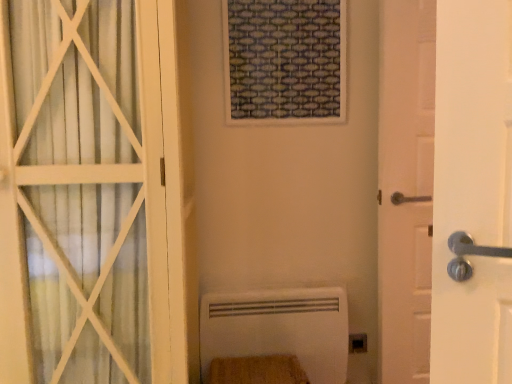
Question: From the image's perspective, would you say white matte door at left, which ranks as the 2th door in right-to-left order, is shown under white wooden door at right, which ranks as the 2th door in left-to-right order?

Choices:
 (A) yes
 (B) no

Answer: (A)

Question: Could you tell me if white matte door at left, which is the 1th door from left to right, is facing white wooden door at right, which ranks as the 2th door in left-to-right order?

Choices:
 (A) no
 (B) yes

Answer: (A)

Question: Is white matte door at left, which ranks as the 2th door in right-to-left order, oriented away from white wooden door at right, which ranks as the 2th door in left-to-right order?

Choices:
 (A) yes
 (B) no

Answer: (B)

Question: Is the position of white matte door at left, which is the 1th door from left to right, less distant than that of white wooden door at right, which ranks as the 2th door in left-to-right order?

Choices:
 (A) yes
 (B) no

Answer: (A)

Question: Is white matte door at left, which ranks as the 2th door in right-to-left order, outside white wooden door at right, which ranks as the 2th door in left-to-right order?

Choices:
 (A) no
 (B) yes

Answer: (B)

Question: From a real-world perspective, is white matte door at left, which is the 1th door from left to right, located higher than white wooden door at right, the 1th door viewed from the right?

Choices:
 (A) yes
 (B) no

Answer: (A)

Question: Could white wooden door at right, the 1th door viewed from the right, be considered to be inside white matte radiator at lower center?

Choices:
 (A) yes
 (B) no

Answer: (B)

Question: Does white matte radiator at lower center appear on the left side of white wooden door at right, the 1th door viewed from the right?

Choices:
 (A) yes
 (B) no

Answer: (A)

Question: From a real-world perspective, is white matte radiator at lower center below white wooden door at right, which ranks as the 2th door in left-to-right order?

Choices:
 (A) no
 (B) yes

Answer: (B)

Question: From the image's perspective, is white matte radiator at lower center beneath white wooden door at right, the 1th door viewed from the right?

Choices:
 (A) no
 (B) yes

Answer: (B)

Question: Could you tell me if white matte radiator at lower center is turned towards white wooden door at right, which ranks as the 2th door in left-to-right order?

Choices:
 (A) yes
 (B) no

Answer: (B)

Question: Is white matte radiator at lower center not close to white wooden door at right, the 1th door viewed from the right?

Choices:
 (A) no
 (B) yes

Answer: (A)

Question: Is black plastic electric outlet at lower right thinner than white matte door at left, which ranks as the 2th door in right-to-left order?

Choices:
 (A) no
 (B) yes

Answer: (B)